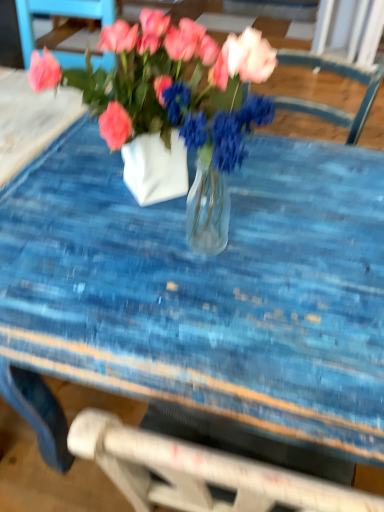
Image resolution: width=384 pixels, height=512 pixels. In order to click on translucent glass vase at center in this screenshot , I will do `click(171, 85)`.

The height and width of the screenshot is (512, 384). Describe the element at coordinates (171, 85) in the screenshot. I see `translucent glass vase at center` at that location.

What are the coordinates of `translucent glass vase at center` in the screenshot? It's located at (171, 85).